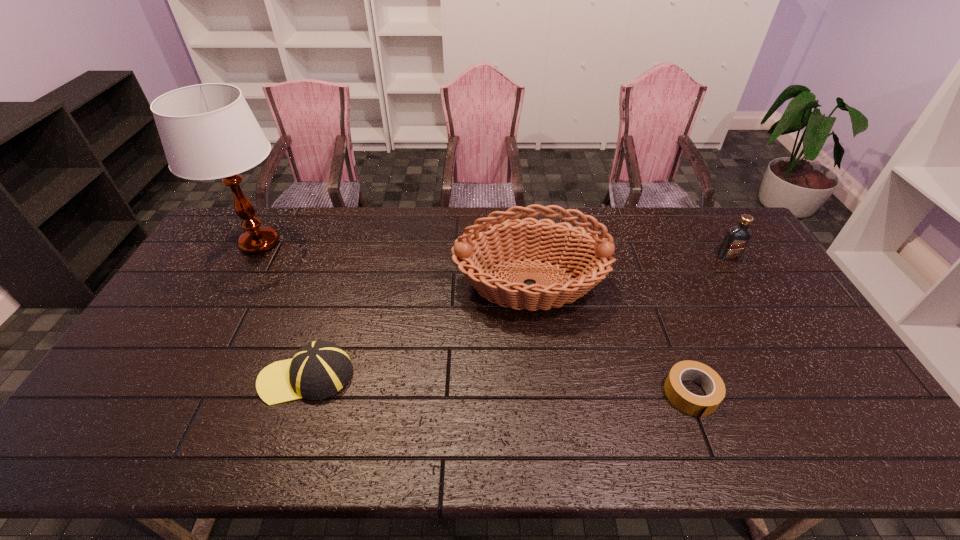
In order to click on vacant space at the far edge of the desktop in this screenshot , I will do `click(534, 208)`.

Where is `vacant area at the left edge`? vacant area at the left edge is located at coordinates 224,301.

Locate an element on the screen. This screenshot has height=540, width=960. blank space at the right edge is located at coordinates (781, 321).

You are a GUI agent. You are given a task and a screenshot of the screen. Output one action in this format:
    pyautogui.click(x=<x>, y=<y>)
    Task: Click on the vacant space at the far right corner of the desktop
    
    Given the screenshot: What is the action you would take?
    pyautogui.click(x=699, y=210)

Locate an element on the screen. vacant space in between the rightmost object and the second tallest object is located at coordinates (629, 270).

The height and width of the screenshot is (540, 960). Identify the location of vacant region between the tallest object and the second object from left to right. (283, 310).

Locate an element on the screen. The image size is (960, 540). vacant space that is in between the duct tape and the tallest object is located at coordinates click(x=475, y=319).

Locate an element on the screen. The image size is (960, 540). vacant point located between the second tallest object and the fourth object from left to right is located at coordinates (611, 340).

Where is `free spot between the second tallest object and the baseball cap`? free spot between the second tallest object and the baseball cap is located at coordinates (419, 330).

At what (x,y) coordinates should I click in order to perform the action: click on free spot between the duct tape and the rightmost object. Please return your answer as a coordinate pair (x, y). Image resolution: width=960 pixels, height=540 pixels. Looking at the image, I should click on (709, 326).